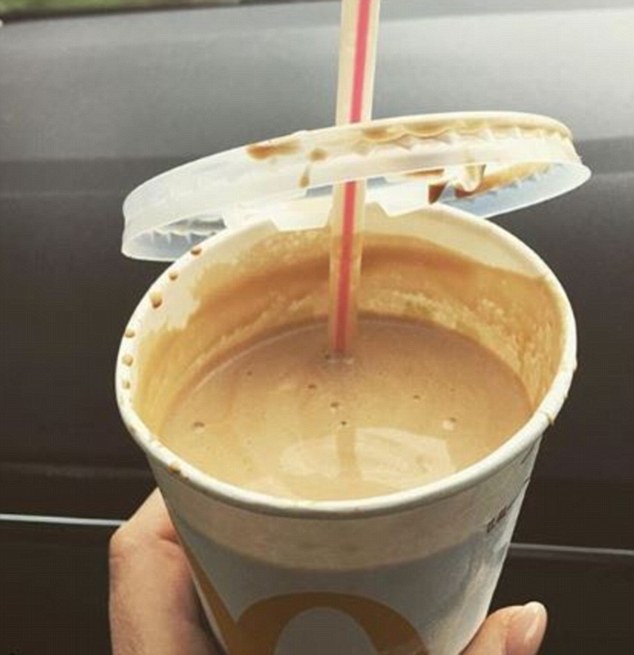
This screenshot has height=655, width=634. Identify the location of inside right side of cup. pyautogui.click(x=538, y=357).